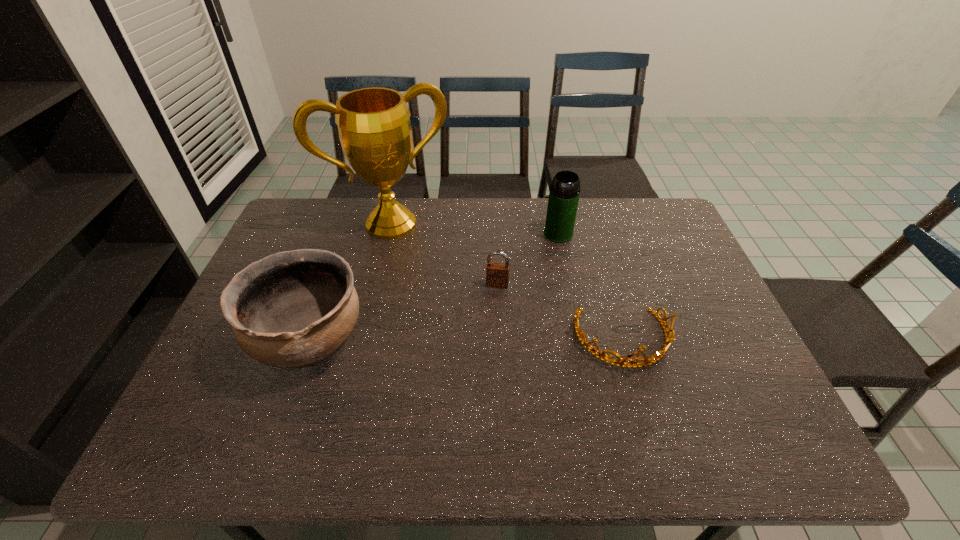
At what (x,y) coordinates should I click in order to perform the action: click on vacant space that satisfies the following two spatial constraints: 1. on the back side of the pottery; 2. on the right side of the award. Please return your answer as a coordinate pair (x, y). Looking at the image, I should click on (350, 224).

This screenshot has width=960, height=540. What are the coordinates of `free region that satisfies the following two spatial constraints: 1. on the back side of the second tallest object; 2. on the left side of the third object from left to right` in the screenshot? It's located at (495, 234).